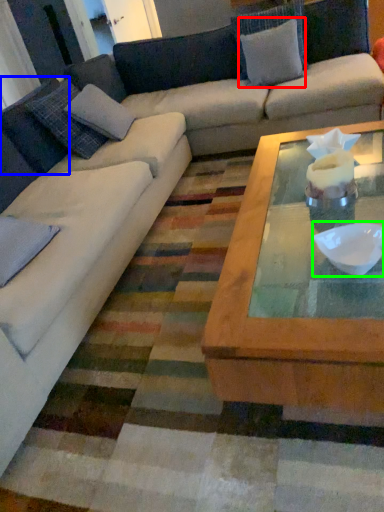
Question: Which object is the closest to the pillow (highlighted by a red box)? Choose among these: pillow (highlighted by a blue box) or bowl (highlighted by a green box).

Choices:
 (A) pillow
 (B) bowl

Answer: (A)